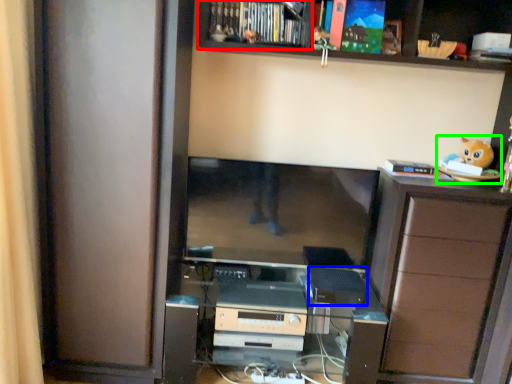
Question: Which is farther away from cabinet (highlighted by a red box)? appliance (highlighted by a blue box) or toy (highlighted by a green box)?

Choices:
 (A) appliance
 (B) toy

Answer: (A)